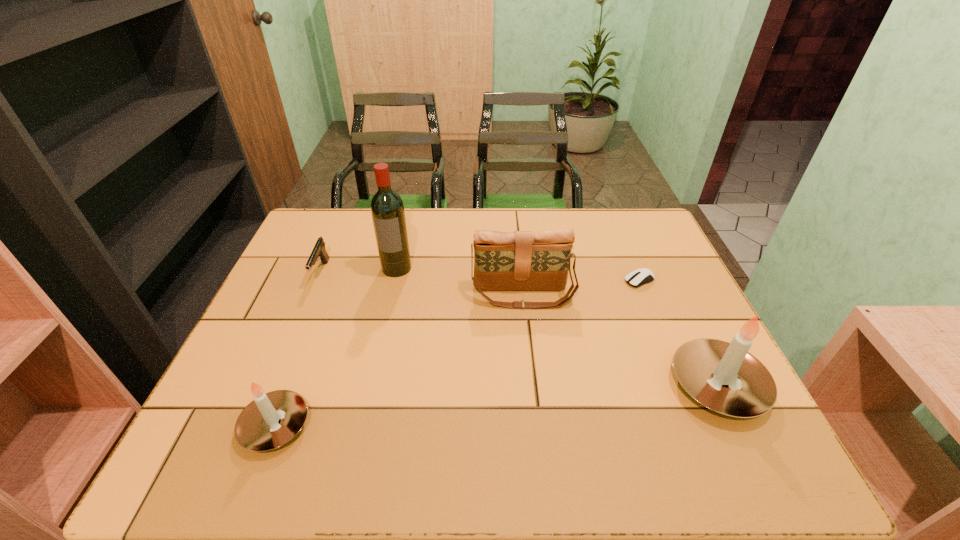
Where is `vacant space that is in between the fourth tallest object and the tallest object`? vacant space that is in between the fourth tallest object and the tallest object is located at coordinates (336, 347).

Locate an element on the screen. The height and width of the screenshot is (540, 960). vacant area between the pistol and the third object from right to left is located at coordinates (422, 284).

The width and height of the screenshot is (960, 540). I want to click on empty space between the third tallest object and the tallest object, so pyautogui.click(x=460, y=281).

Find the location of a particular element. The width and height of the screenshot is (960, 540). vacant space in between the fifth tallest object and the third object from right to left is located at coordinates (422, 284).

Identify the location of object that can be found as the fifth closest to the wine bottle. (702, 366).

Where is `object that ranks as the fourth closest to the shortest object`? The width and height of the screenshot is (960, 540). object that ranks as the fourth closest to the shortest object is located at coordinates (272, 419).

The width and height of the screenshot is (960, 540). Find the location of `blank area in the image that satisfies the following two spatial constraints: 1. on the label of the shortest object; 2. on the right side of the tallest object`. blank area in the image that satisfies the following two spatial constraints: 1. on the label of the shortest object; 2. on the right side of the tallest object is located at coordinates (394, 280).

Find the location of a particular element. The height and width of the screenshot is (540, 960). vacant space that satisfies the following two spatial constraints: 1. at the muzzle of the second shortest object; 2. on the right side of the third shortest object is located at coordinates (257, 426).

Where is `free space in the image that satisfies the following two spatial constraints: 1. on the front-facing side of the third object from right to left; 2. on the left side of the taller candle`? Image resolution: width=960 pixels, height=540 pixels. free space in the image that satisfies the following two spatial constraints: 1. on the front-facing side of the third object from right to left; 2. on the left side of the taller candle is located at coordinates (532, 386).

Identify the location of free space that satisfies the following two spatial constraints: 1. on the label of the shortest object; 2. on the left side of the tallest object. (394, 280).